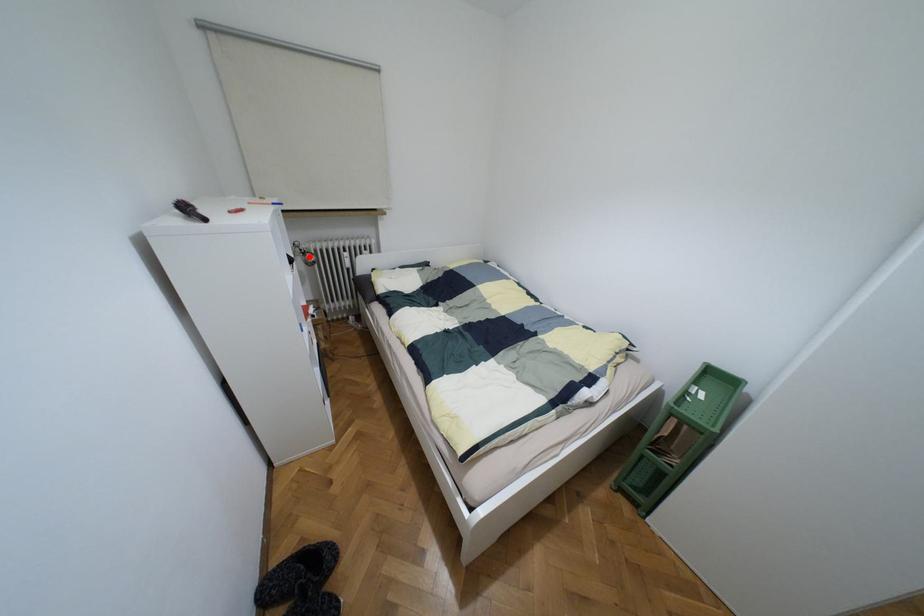
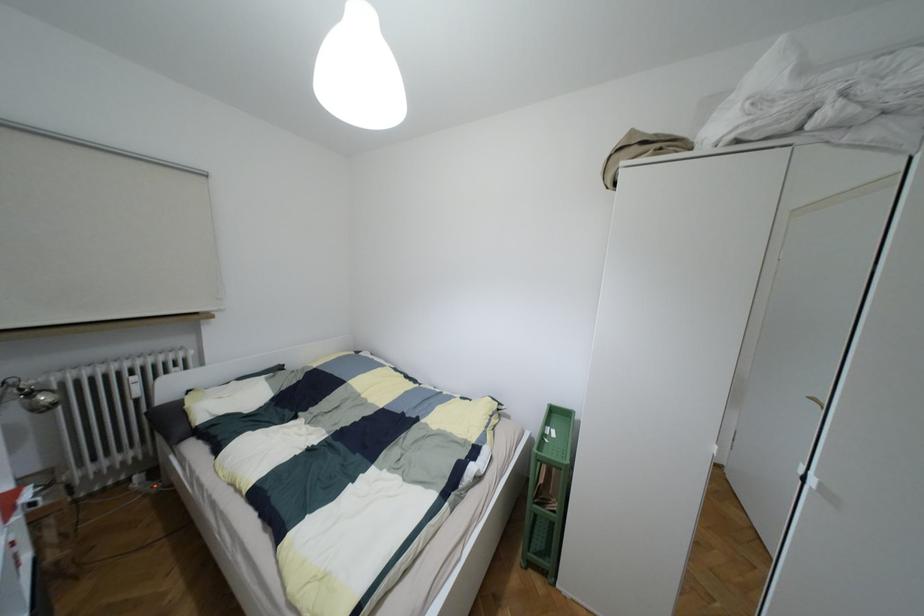
Question: I am providing you with two images of the same scene from different viewpoints. A red point is shown in image1. For the corresponding object point in image2, is it positioned nearer or farther from the camera?

Choices:
 (A) Nearer
 (B) Farther

Answer: (B)